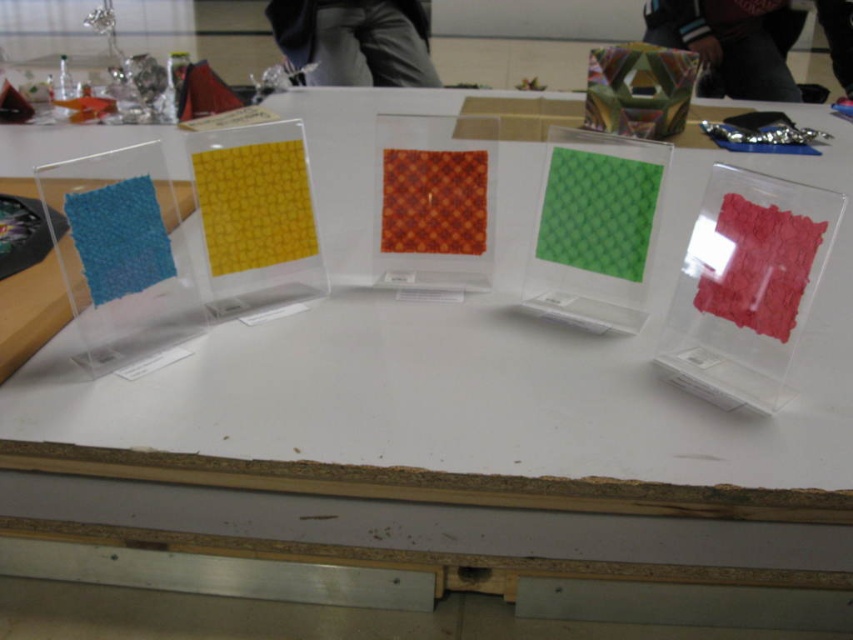
You are a customer at a fabric store and want to know which of the two center items, the yellow textured paper at center or the matte red fabric at center, is taller. Based on the display setup described, which one is taller?

The yellow textured paper at center is taller than the matte red fabric at center according to the description.

You are a store employee arranging items on a shelf. You have two items to place next to each other on the shelf. The items are the yellow textured paper at center and the matte red fabric at center. The shelf has a width of 80 centimeters. Can both items fit side by side on the shelf without exceeding its width?

The distance between the yellow textured paper at center and matte red fabric at center is 72.60 centimeters. Since the shelf is 80 centimeters wide, there is enough space to place both items side by side as 72.60 cm is less than 80 cm.

You are a customer at a fabric store looking at the display. You see the matte red fabric at center and the metallic hexagonal prism at upper center. Which object is positioned higher in the display?

The metallic hexagonal prism at upper center is positioned higher than the matte red fabric at center.